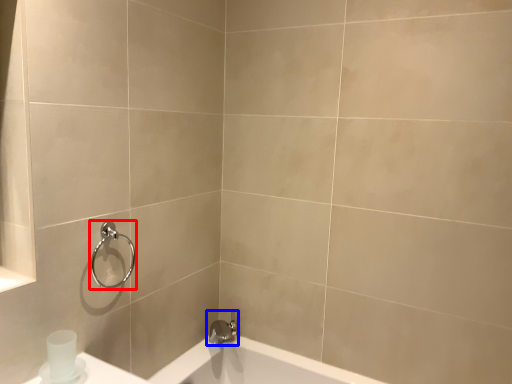
Question: Which object appears farthest to the camera in this image, shower (highlighted by a red box) or tap (highlighted by a blue box)?

Choices:
 (A) shower
 (B) tap

Answer: (B)